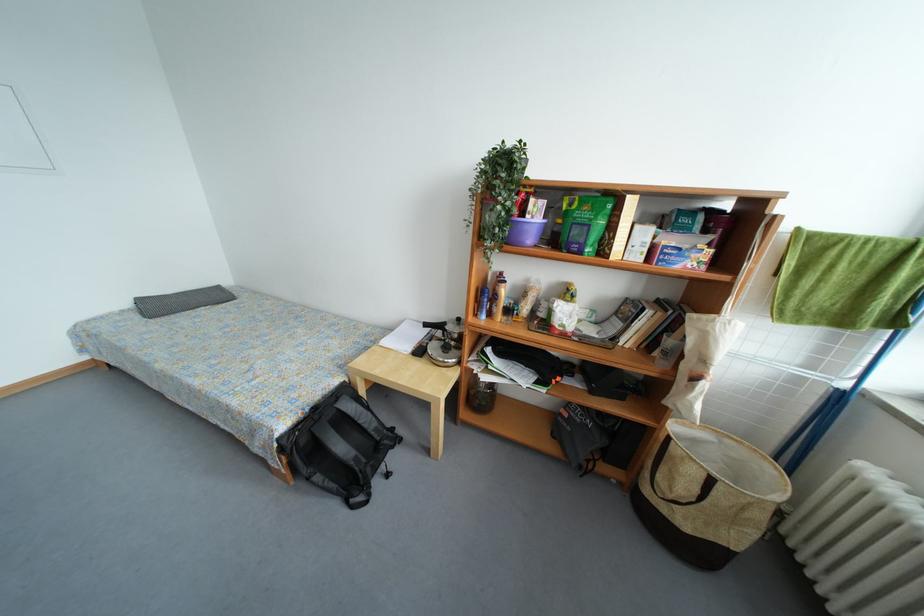
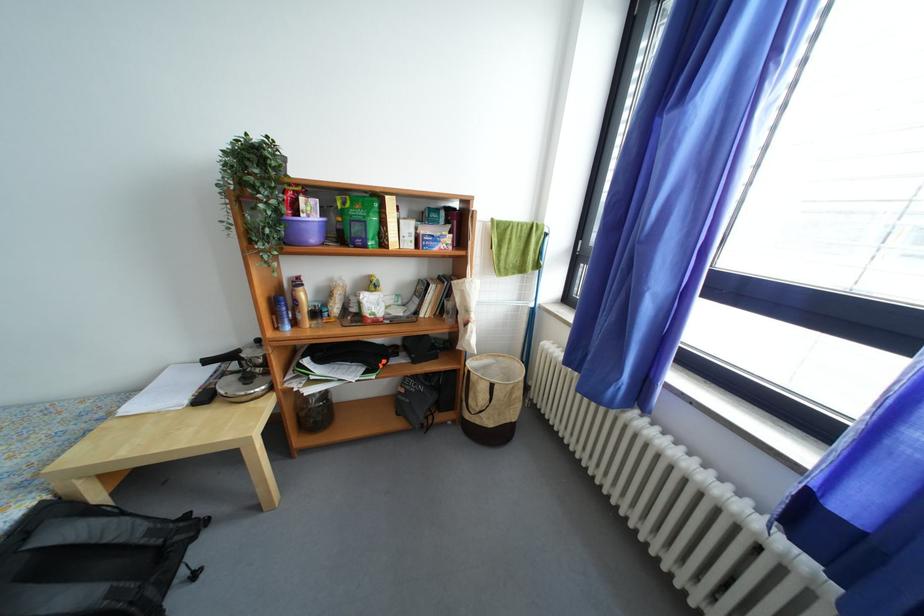
Where in the second image is the point corresponding to (x=537, y=244) from the first image?

(320, 243)